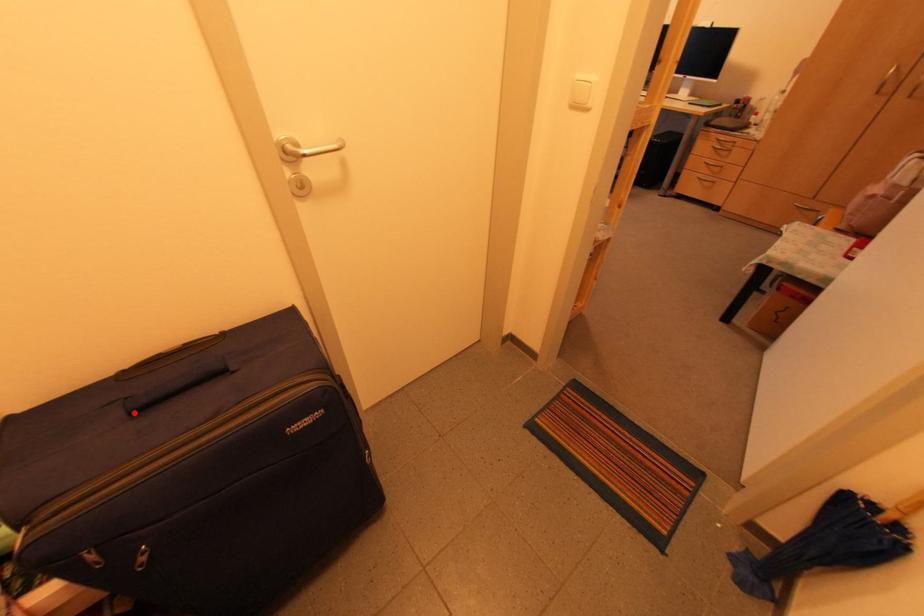
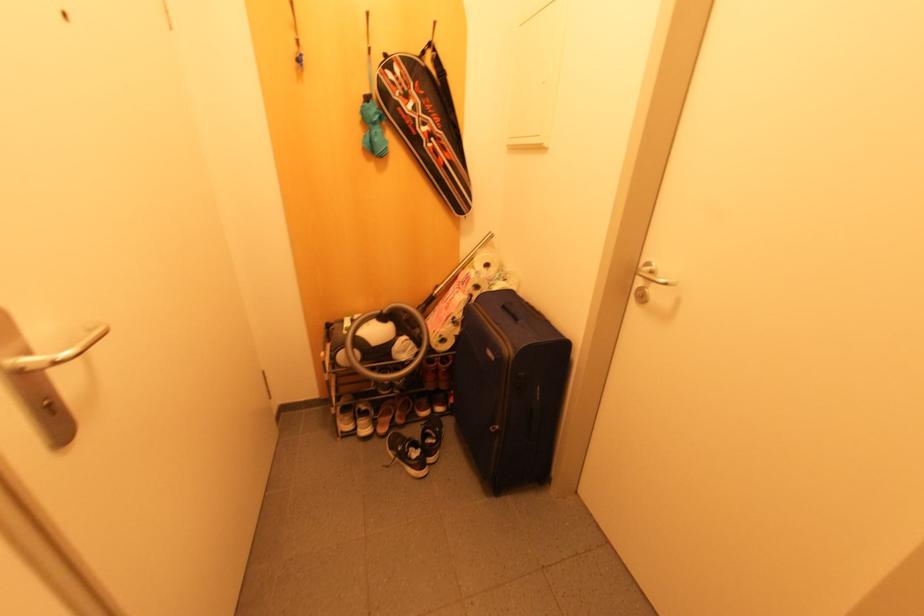
The point at the highlighted location is marked in the first image. Where is the corresponding point in the second image?

(503, 307)